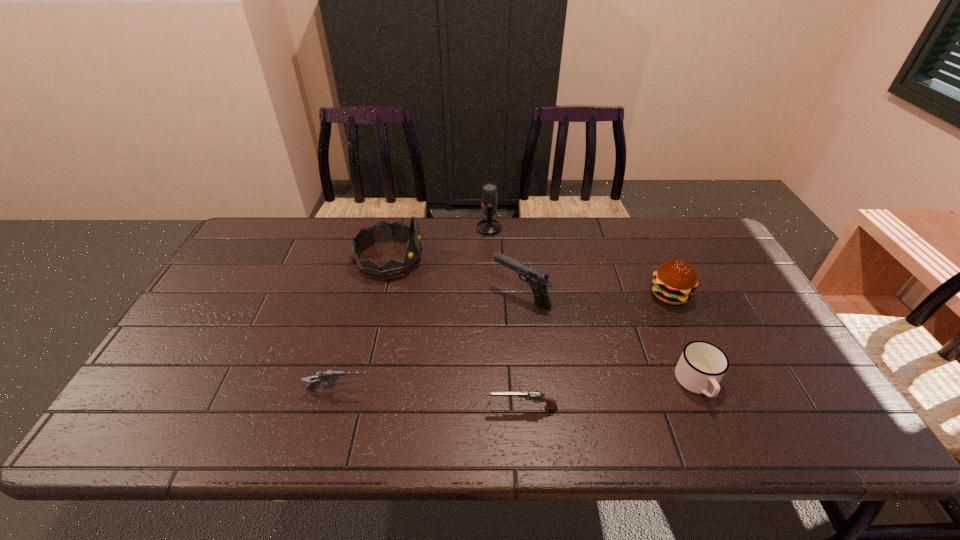
The width and height of the screenshot is (960, 540). What are the coordinates of `free region at the near right corner` in the screenshot? It's located at (770, 417).

Where is `vacant area that lies between the second nearest gun and the hamburger`? vacant area that lies between the second nearest gun and the hamburger is located at coordinates (504, 343).

This screenshot has width=960, height=540. What are the coordinates of `vacant area between the shortest object and the mug` in the screenshot? It's located at (611, 396).

The width and height of the screenshot is (960, 540). In order to click on vacant space that's between the tallest gun and the mug in this screenshot , I will do `click(610, 340)`.

The image size is (960, 540). I want to click on free spot between the tiara and the second farthest gun, so click(364, 325).

In order to click on vacant point located between the hamburger and the shortest object in this screenshot , I will do `click(596, 352)`.

I want to click on free space between the second farthest gun and the shortest gun, so click(x=431, y=400).

The height and width of the screenshot is (540, 960). I want to click on empty space between the farthest gun and the mug, so click(610, 340).

You are a GUI agent. You are given a task and a screenshot of the screen. Output one action in this format:
    pyautogui.click(x=<x>, y=<y>)
    Task: Click on the vacant region between the mug and the farthest object
    
    Given the screenshot: What is the action you would take?
    pyautogui.click(x=593, y=306)

Locate an element on the screen. free space between the tallest gun and the hamburger is located at coordinates (595, 295).